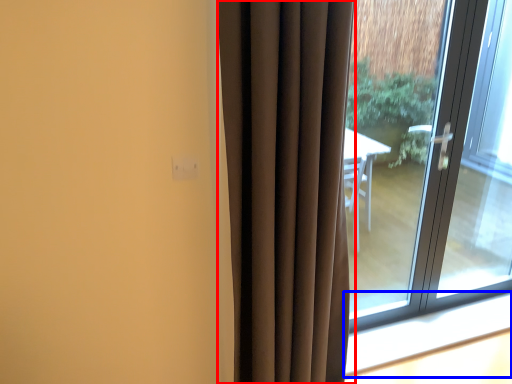
Question: Which point is closer to the camera, curtain (highlighted by a red box) or window sill (highlighted by a blue box)?

Choices:
 (A) curtain
 (B) window sill

Answer: (A)